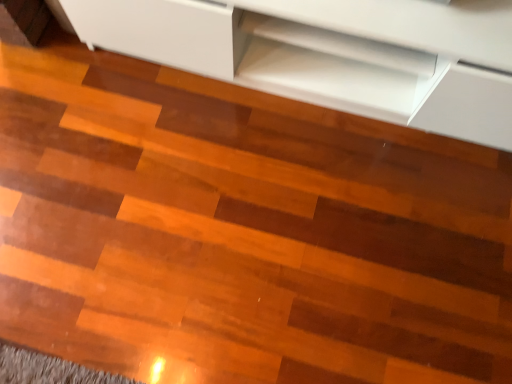
The width and height of the screenshot is (512, 384). I want to click on matte white cabinet at upper center, so click(314, 58).

What do you see at coordinates (314, 58) in the screenshot? I see `matte white cabinet at upper center` at bounding box center [314, 58].

Find the location of a particular element. This screenshot has height=384, width=512. matte white cabinet at upper center is located at coordinates (314, 58).